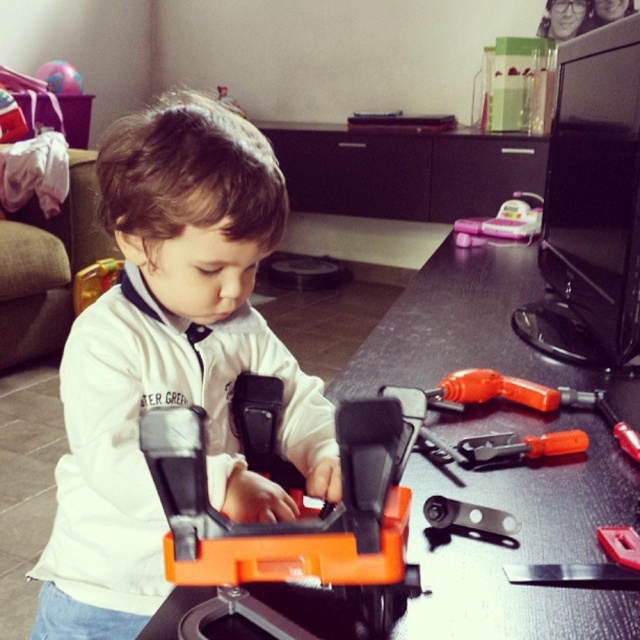
Consider the image. How far apart are black glossy table at center and orange plastic screwdriver at center?

13.61 inches

Find the location of a particular element. This screenshot has width=640, height=640. black glossy table at center is located at coordinates (481, 328).

Can you confirm if orange plastic tool at center is thinner than orange plastic tool at lower right?

No.

Is orange plastic tool at center wider than orange plastic tool at lower right?

Indeed, orange plastic tool at center has a greater width compared to orange plastic tool at lower right.

Does point (164, 420) lie in front of point (621, 556)?

Yes, point (164, 420) is closer to viewer.

Locate an element on the screen. The image size is (640, 640). orange plastic tool at center is located at coordinates (289, 522).

From the picture: Is orange plastic screwdriver at center positioned at the back of orange plastic tool at lower right?

Yes, orange plastic screwdriver at center is behind orange plastic tool at lower right.

Is orange plastic screwdriver at center closer to camera compared to orange plastic tool at lower right?

No, orange plastic screwdriver at center is further to the viewer.

Does point (476, 467) lie in front of point (618, 532)?

No, it is behind (618, 532).

Locate an element on the screen. orange plastic screwdriver at center is located at coordinates (518, 445).